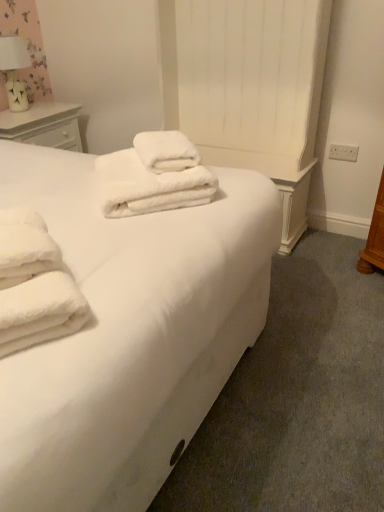
Question: Does white soft towels at center lie behind white wood nightstand at upper left?

Choices:
 (A) yes
 (B) no

Answer: (B)

Question: Is white soft towels at center oriented towards white wood nightstand at upper left?

Choices:
 (A) yes
 (B) no

Answer: (B)

Question: From a real-world perspective, is white soft towels at center below white wood nightstand at upper left?

Choices:
 (A) no
 (B) yes

Answer: (A)

Question: Does white soft towels at center contain white wood nightstand at upper left?

Choices:
 (A) yes
 (B) no

Answer: (B)

Question: Does white soft towels at center have a greater width compared to white wood nightstand at upper left?

Choices:
 (A) no
 (B) yes

Answer: (B)

Question: Does point (221, 376) appear closer or farther from the camera than point (3, 112)?

Choices:
 (A) farther
 (B) closer

Answer: (B)

Question: Considering the relative positions of white soft towels at center and white wood nightstand at upper left in the image provided, is white soft towels at center to the left or to the right of white wood nightstand at upper left?

Choices:
 (A) right
 (B) left

Answer: (A)

Question: Is white soft towels at center wider or thinner than white wood nightstand at upper left?

Choices:
 (A) thin
 (B) wide

Answer: (B)

Question: Is white soft towels at center inside the boundaries of white wood nightstand at upper left, or outside?

Choices:
 (A) outside
 (B) inside

Answer: (A)

Question: Looking at the image, does white soft towels at center seem bigger or smaller compared to white ceramic table lamp at upper left?

Choices:
 (A) small
 (B) big

Answer: (B)

Question: In the image, is white soft towels at center positioned in front of or behind white ceramic table lamp at upper left?

Choices:
 (A) front
 (B) behind

Answer: (A)

Question: Considering the relative positions of white soft towels at center and white ceramic table lamp at upper left in the image provided, is white soft towels at center to the left or to the right of white ceramic table lamp at upper left?

Choices:
 (A) right
 (B) left

Answer: (A)

Question: From the image's perspective, is white soft towels at center above or below white ceramic table lamp at upper left?

Choices:
 (A) below
 (B) above

Answer: (A)

Question: In the image, is white ceramic table lamp at upper left positioned in front of or behind white wood nightstand at upper left?

Choices:
 (A) front
 (B) behind

Answer: (B)

Question: From a real-world perspective, is white ceramic table lamp at upper left positioned above or below white wood nightstand at upper left?

Choices:
 (A) below
 (B) above

Answer: (B)